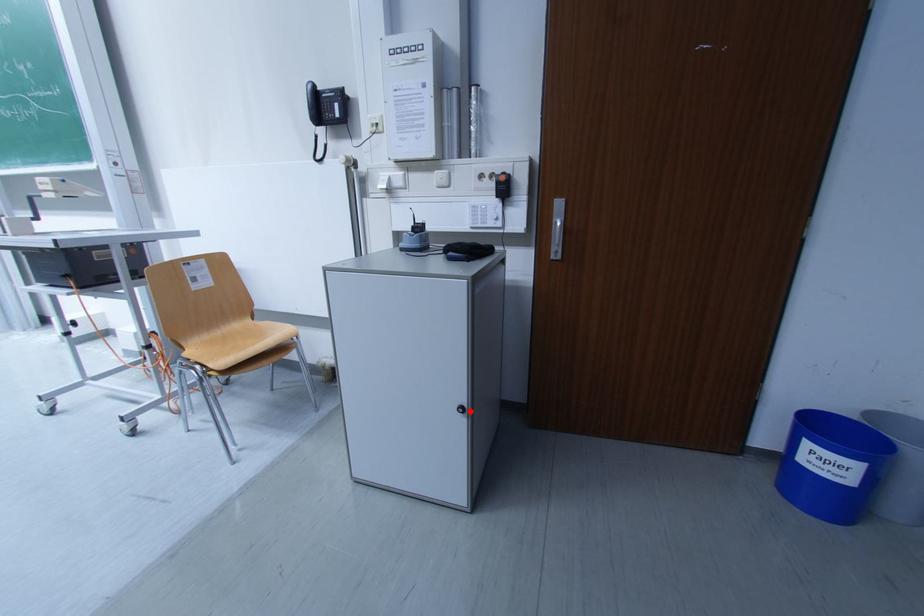
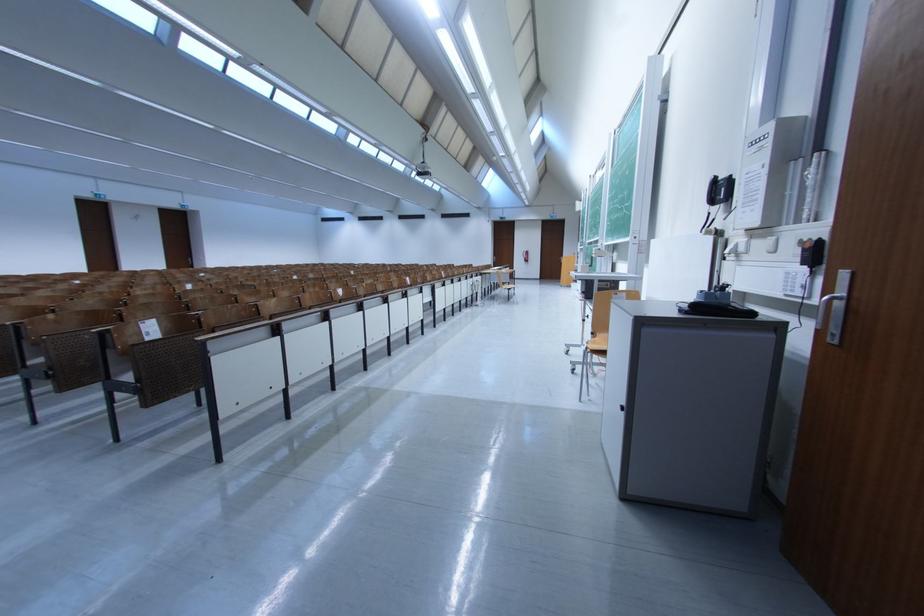
Question: I am providing you with two images of the same scene from different viewpoints. A red point is shown in image1. For the corresponding object point in image2, is it positioned nearer or farther from the camera?

Choices:
 (A) Nearer
 (B) Farther

Answer: (A)